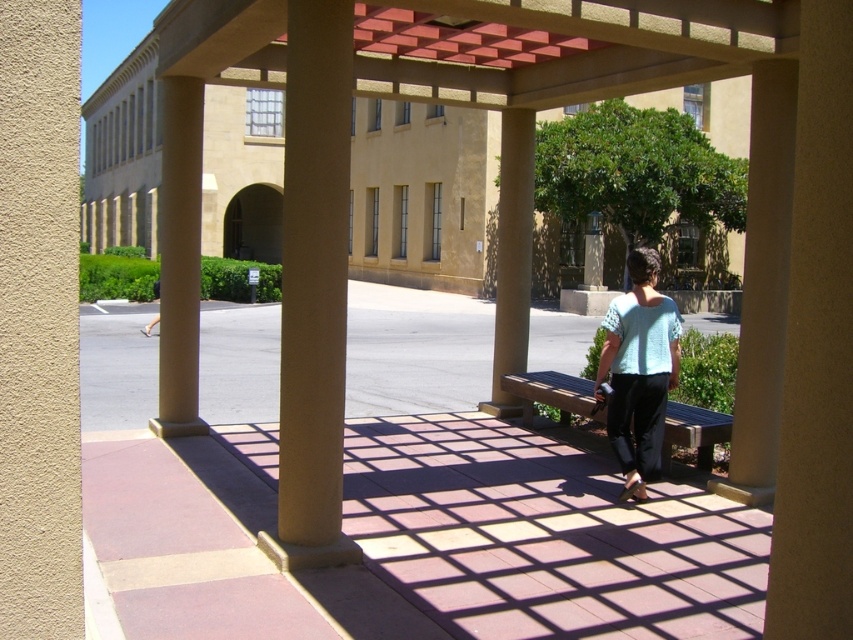
Question: Which point is farther to the camera?

Choices:
 (A) (167, 80)
 (B) (300, 116)
 (C) (635, 486)
 (D) (419, 317)

Answer: (D)

Question: Observing the image, what is the correct spatial positioning of light blue knitted sweater at center-right in reference to wooden bench at center?

Choices:
 (A) below
 (B) above

Answer: (B)

Question: Based on their relative distances, which object is farther from the light blue knitted sweater at center-right?

Choices:
 (A) wooden bench at center
 (B) smooth concrete bench at center
 (C) beige concrete pillar at center

Answer: (B)

Question: Which object is the farthest from the light blue knitted sweater at center-right?

Choices:
 (A) smooth concrete bench at center
 (B) beige concrete pillar at center
 (C) beige polished stone column at center
 (D) wooden bench at center

Answer: (A)

Question: Is light blue knitted sweater at center-right positioned at the back of wooden bench at center?

Choices:
 (A) no
 (B) yes

Answer: (A)

Question: Can you confirm if beige concrete column at center is wider than wooden bench at center?

Choices:
 (A) no
 (B) yes

Answer: (A)